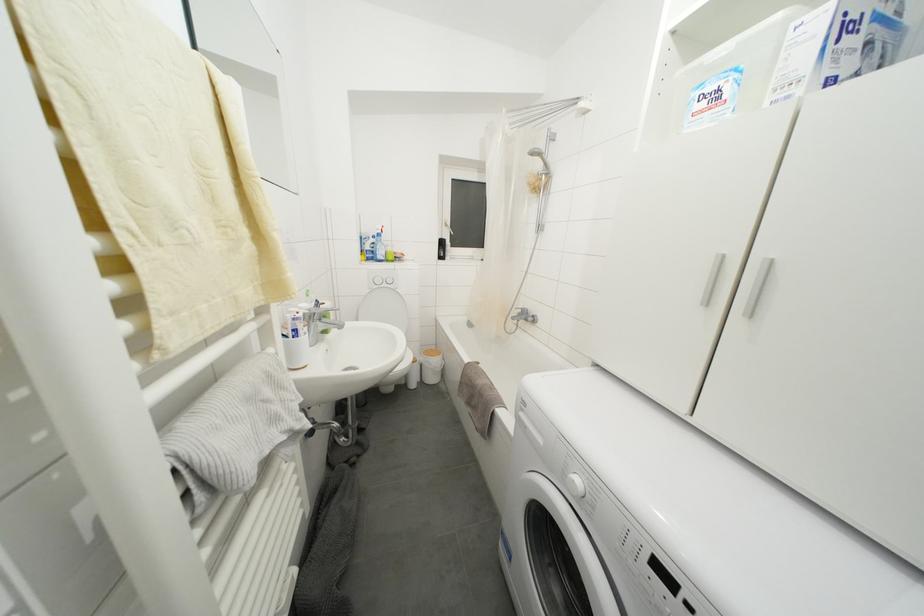
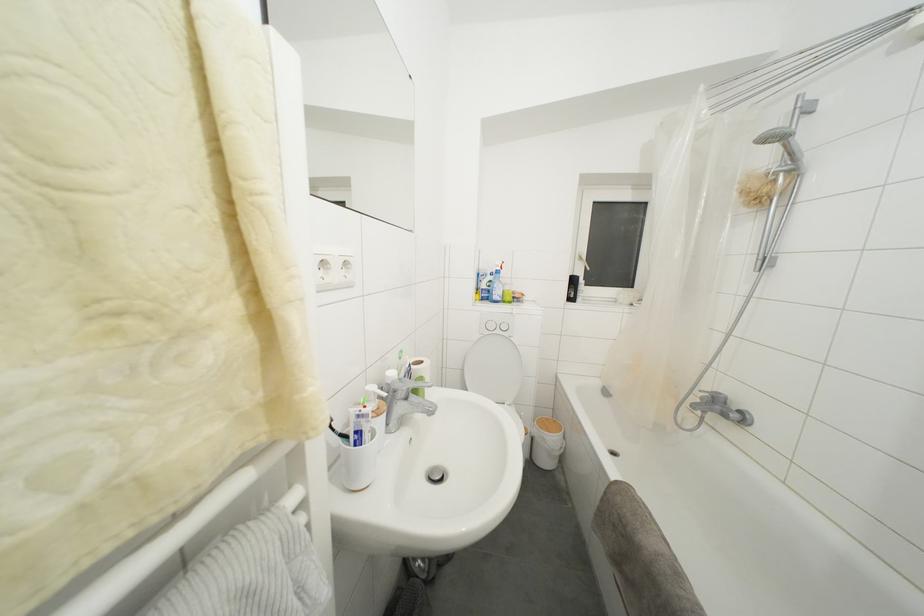
Find the pixel in the second image that matches the point at 374,261 in the first image.

(490, 301)